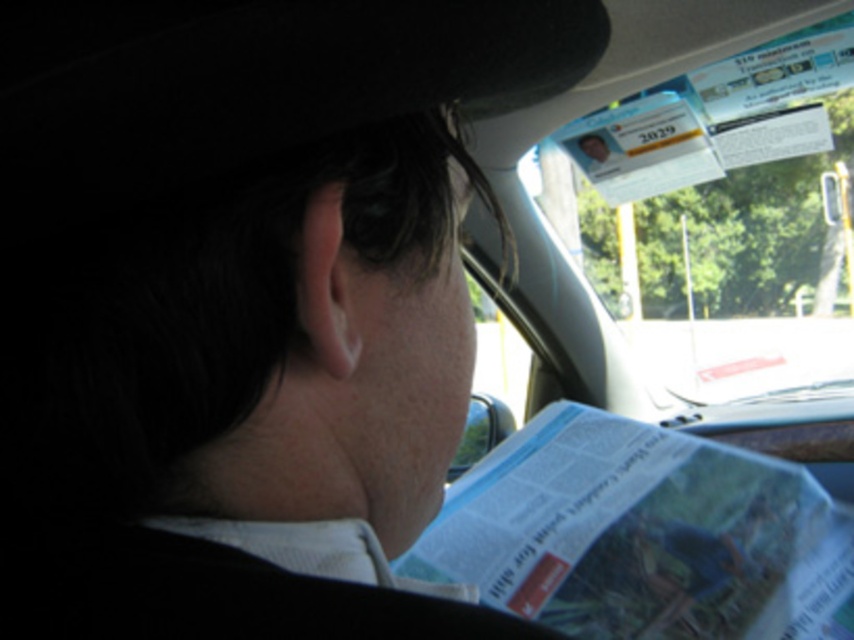
Question: Can you confirm if white glossy paper at lower center is thinner than transparent plastic window at upper center?

Choices:
 (A) no
 (B) yes

Answer: (B)

Question: From the image, what is the correct spatial relationship of white glossy paper at lower center in relation to transparent plastic window at upper center?

Choices:
 (A) below
 (B) above

Answer: (A)

Question: Is white glossy paper at lower center further to the viewer compared to transparent plastic window at upper center?

Choices:
 (A) yes
 (B) no

Answer: (B)

Question: Which point is closer to the camera?

Choices:
 (A) white glossy paper at lower center
 (B) transparent plastic window at upper center

Answer: (A)

Question: Among these objects, which one is nearest to the camera?

Choices:
 (A) transparent plastic window at upper center
 (B) white glossy paper at lower center

Answer: (B)